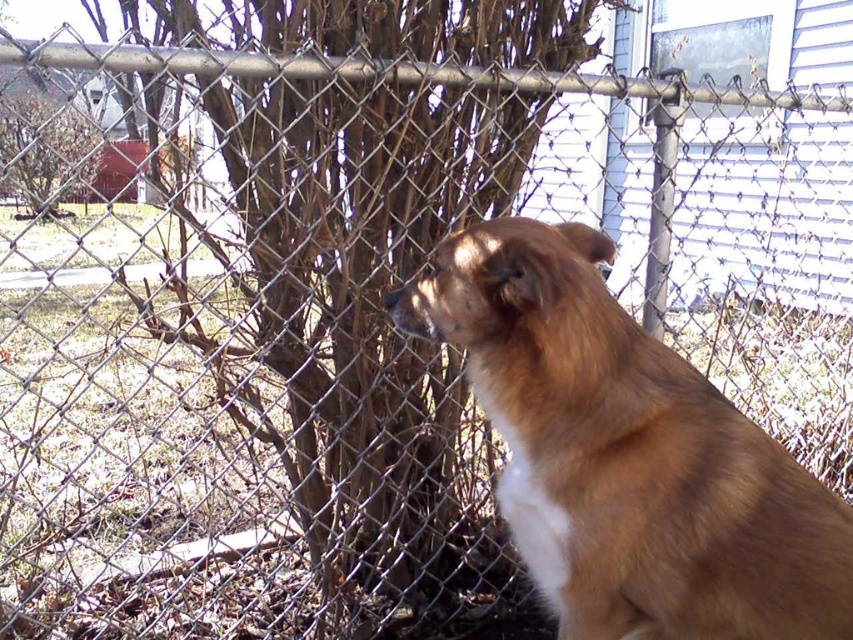
Does point (701, 605) come closer to viewer compared to point (16, 179)?

Yes, it is in front of point (16, 179).

The height and width of the screenshot is (640, 853). What do you see at coordinates (625, 452) in the screenshot?
I see `brown fluffy dog at center` at bounding box center [625, 452].

What do you see at coordinates (625, 452) in the screenshot? The width and height of the screenshot is (853, 640). I see `brown fluffy dog at center` at bounding box center [625, 452].

Locate an element on the screen. The height and width of the screenshot is (640, 853). brown fluffy dog at center is located at coordinates (625, 452).